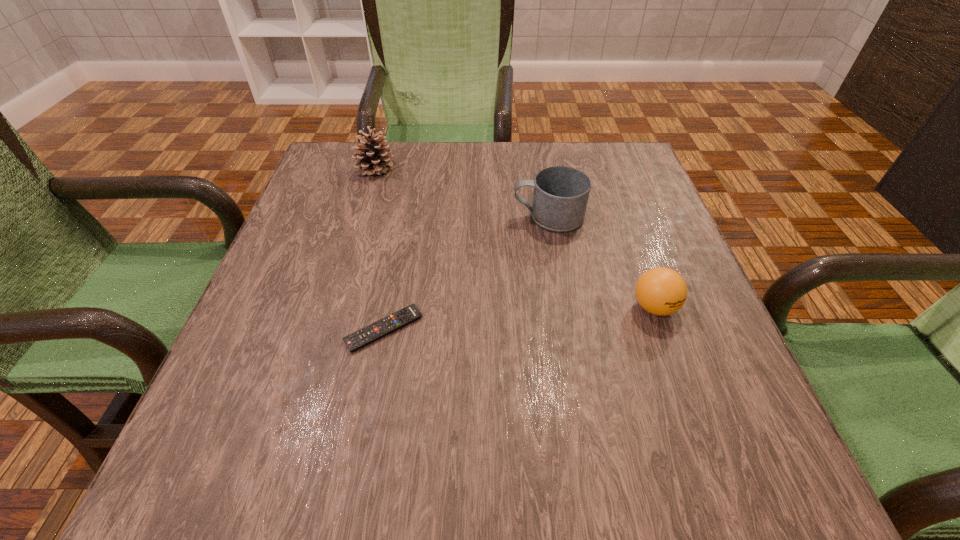
Identify the location of vacant space at the far right corner of the desktop. click(x=613, y=165).

You are a GUI agent. You are given a task and a screenshot of the screen. Output one action in this format:
    pyautogui.click(x=<x>, y=<y>)
    Task: Click on the vacant space that's between the mug and the farthest object
    The height and width of the screenshot is (540, 960).
    Given the screenshot: What is the action you would take?
    pyautogui.click(x=462, y=193)

Locate an element on the screen. This screenshot has width=960, height=540. free point between the rightmost object and the second farthest object is located at coordinates (601, 262).

You are a GUI agent. You are given a task and a screenshot of the screen. Output one action in this format:
    pyautogui.click(x=<x>, y=<y>)
    Task: Click on the free space between the pinecone and the remote control
    The width and height of the screenshot is (960, 540).
    Given the screenshot: What is the action you would take?
    pyautogui.click(x=379, y=249)

The height and width of the screenshot is (540, 960). I want to click on empty location between the remote control and the second object from right to left, so click(467, 273).

Locate an element on the screen. This screenshot has height=540, width=960. unoccupied area between the ping-pong ball and the mug is located at coordinates (601, 262).

This screenshot has width=960, height=540. Find the location of `unoccupied area between the remote control and the third nearest object`. unoccupied area between the remote control and the third nearest object is located at coordinates (467, 273).

Find the location of a particular element. This screenshot has height=540, width=960. free area in between the shortest object and the rightmost object is located at coordinates (519, 318).

This screenshot has width=960, height=540. Identify the location of unoccupied area between the pinecone and the mug. (462, 193).

At what (x,y) coordinates should I click in order to perform the action: click on unoccupied position between the pinecone and the shortest object. Please return your answer as a coordinate pair (x, y). This screenshot has height=540, width=960. Looking at the image, I should click on (379, 249).